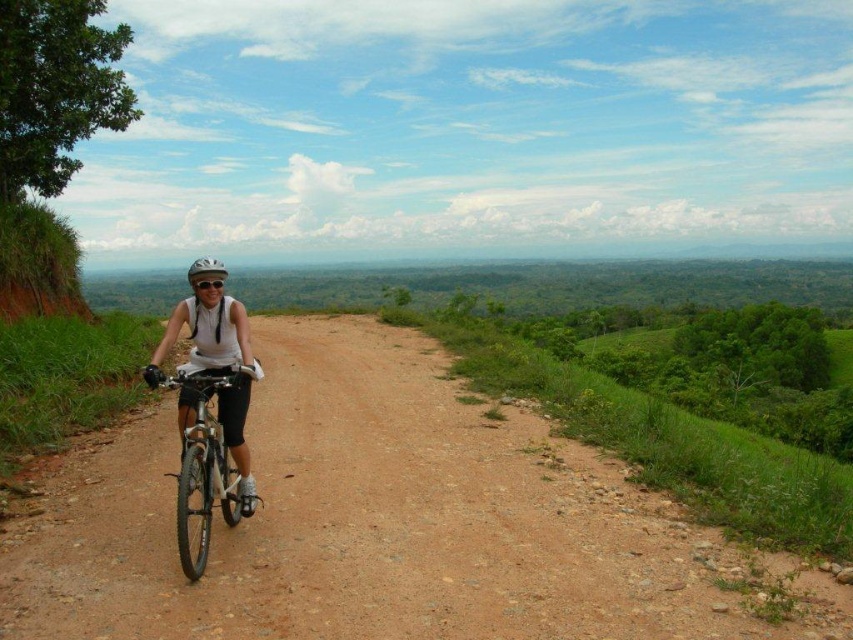
You are a drone operator trying to capture a photo of the cyclist. The drone is currently 5 meters above the cyclist. To get a clear shot, you need to adjust the drone to be exactly 5.17 meters away from the cyclist. Is the white matte helmet at center currently within the drone camera frame?

The white matte helmet at center is 5.17 meters away from camera. Since the drone is 5 meters above the cyclist, the distance between the drone and the helmet is slightly more than 5 meters. Therefore, the white matte helmet at center is within the drone camera frame as it is at the required 5.17 meters distance.